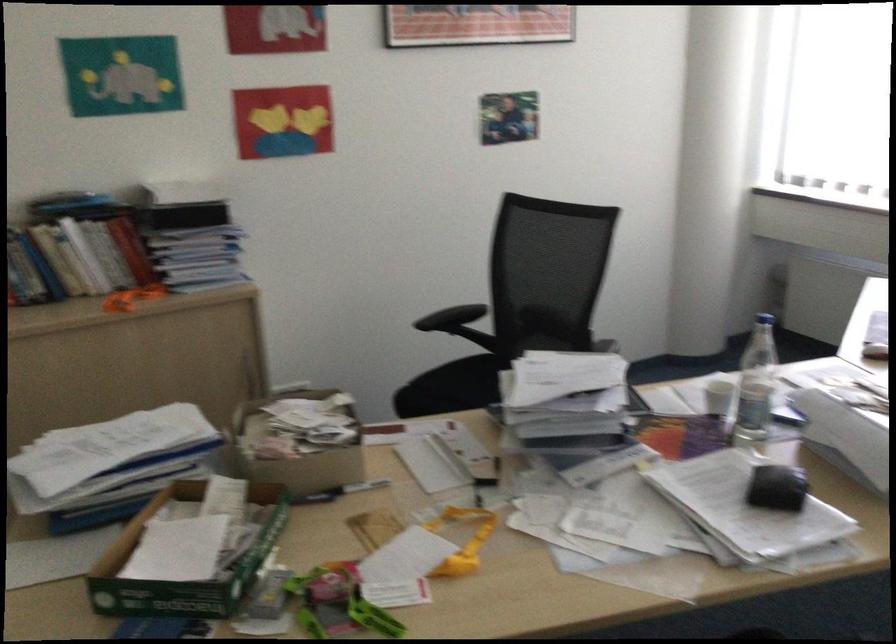
In order to click on chair sitting surface in this screenshot , I will do `click(452, 386)`.